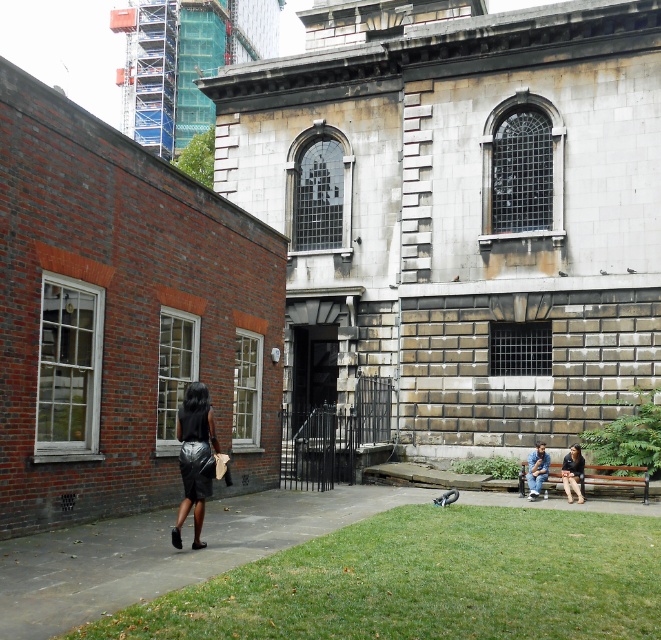
Question: Which of the following is the closest to the observer?

Choices:
 (A) blue denim jeans at lower right
 (B) gray feathered pigeon at lower center
 (C) shiny black skirt at left
 (D) black leather jacket at lower right

Answer: (C)

Question: Which point is farther to the camera?

Choices:
 (A) click(x=570, y=451)
 (B) click(x=527, y=496)
 (C) click(x=545, y=573)
 (D) click(x=576, y=477)

Answer: (B)

Question: Does black leather jacket at lower right have a smaller size compared to gray feathered pigeon at lower center?

Choices:
 (A) yes
 (B) no

Answer: (B)

Question: Is shiny black skirt at left wider than gray feathered pigeon at lower center?

Choices:
 (A) no
 (B) yes

Answer: (B)

Question: Is green grass at lower center to the right of shiny black skirt at left from the viewer's perspective?

Choices:
 (A) yes
 (B) no

Answer: (A)

Question: Which of the following is the farthest from the observer?

Choices:
 (A) wooden bench at lower right
 (B) gray feathered pigeon at lower center
 (C) green grass at lower center

Answer: (A)